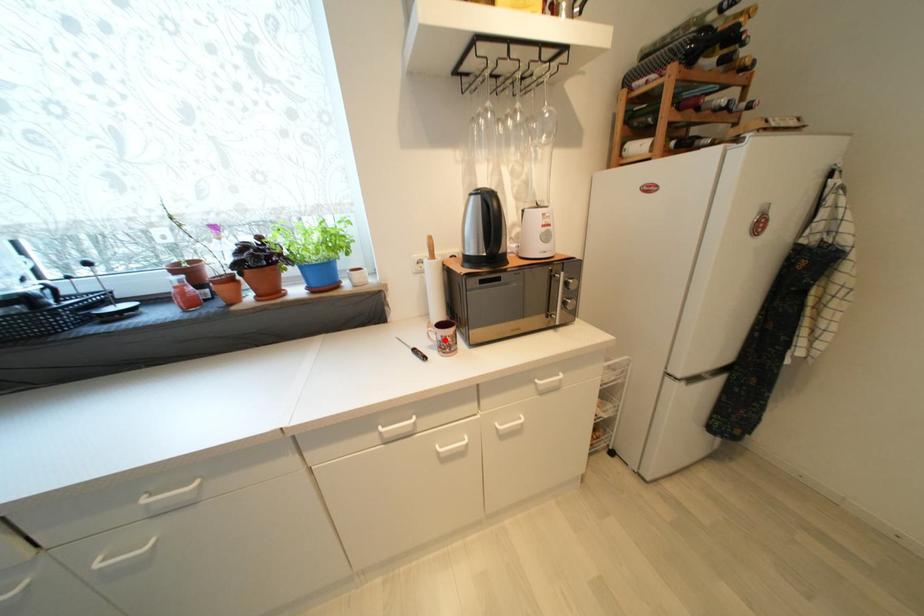
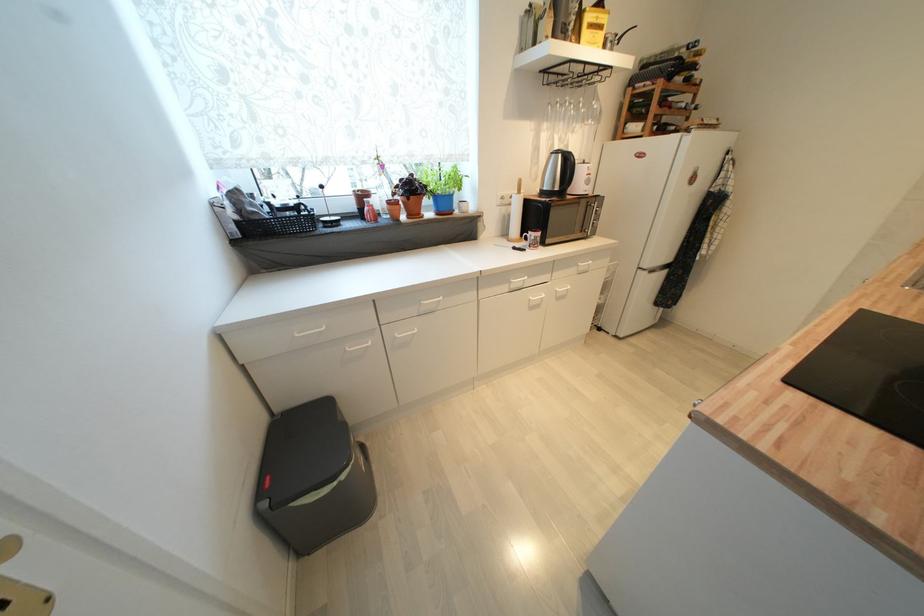
Question: I am providing you with two images of the same scene from different viewpoints. A red point is marked on the first image. Is the red point's position out of view in image 2?

Choices:
 (A) Yes
 (B) No

Answer: (B)